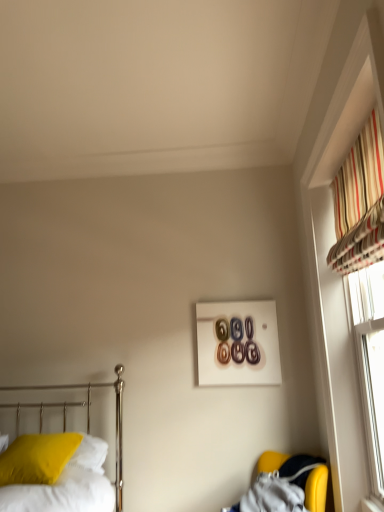
Question: Considering the positions of matte yellow pillow at lower left and metallic bed at left in the image, is matte yellow pillow at lower left wider or thinner than metallic bed at left?

Choices:
 (A) thin
 (B) wide

Answer: (A)

Question: Is point (41, 462) positioned closer to the camera than point (54, 387)?

Choices:
 (A) farther
 (B) closer

Answer: (B)

Question: Which is farther from the metallic bed at left?

Choices:
 (A) striped fabric at upper right
 (B) matte yellow pillow at lower left
 (C) white glossy picture frame at center
 (D) yellow fabric armchair at lower right

Answer: (A)

Question: Which is nearer to the striped fabric at upper right?

Choices:
 (A) metallic bed at left
 (B) white glossy picture frame at center
 (C) matte yellow pillow at lower left
 (D) yellow fabric armchair at lower right

Answer: (B)